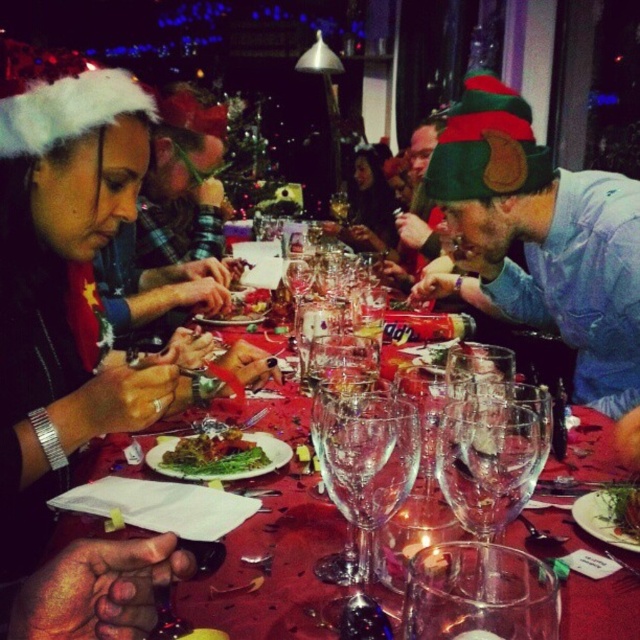
Based on the photo, you are a guest at this holiday table and want to reach for the transparent glass wine glass at center without disturbing the green felt hat at upper right. Can you safely do so from your current position?

The green felt hat at upper right is 1.04 meters away from the transparent glass wine glass at center. Since the distance is sufficient, you can safely reach for the transparent glass wine glass at center without disturbing the green felt hat at upper right.

You are standing at the center of the table in the festive dining scene. You need to locate the green felt hat at upper right. Where exactly is it positioned relative to your current location?

The green felt hat at upper right is positioned at coordinates point (x=545, y=237) relative to your current location at the center of the table.